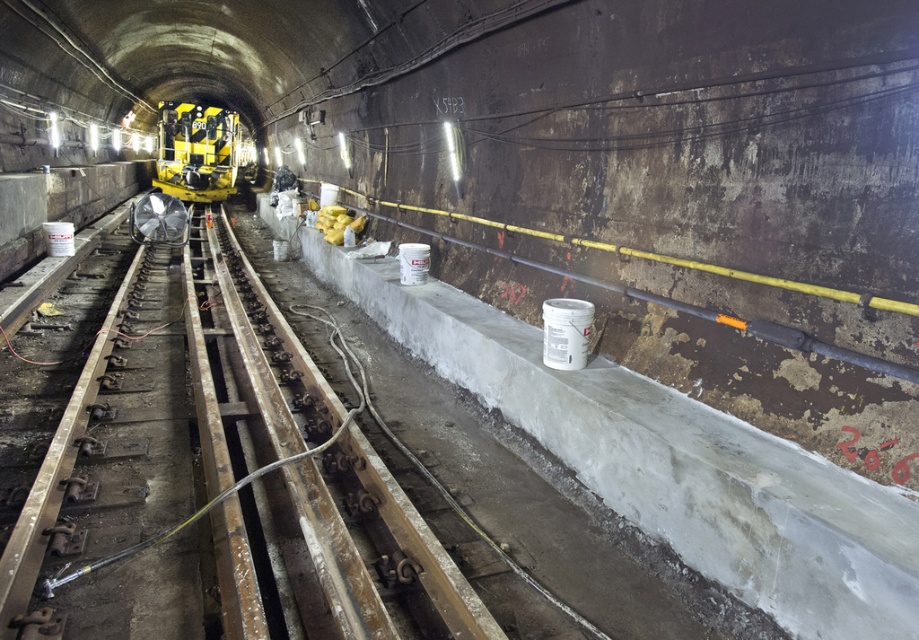
You are standing at the entrance of the tunnel and see the point marked at coordinates (369,552). What object is located at that point?

The point marked at coordinates (369,552) marks the rusty metal train track at center.

You are a worker in the tunnel and need to check the length of the rusty metal train track at center and the yellow matte subway at center. Which one is longer?

The yellow matte subway at center is longer than the rusty metal train track at center.